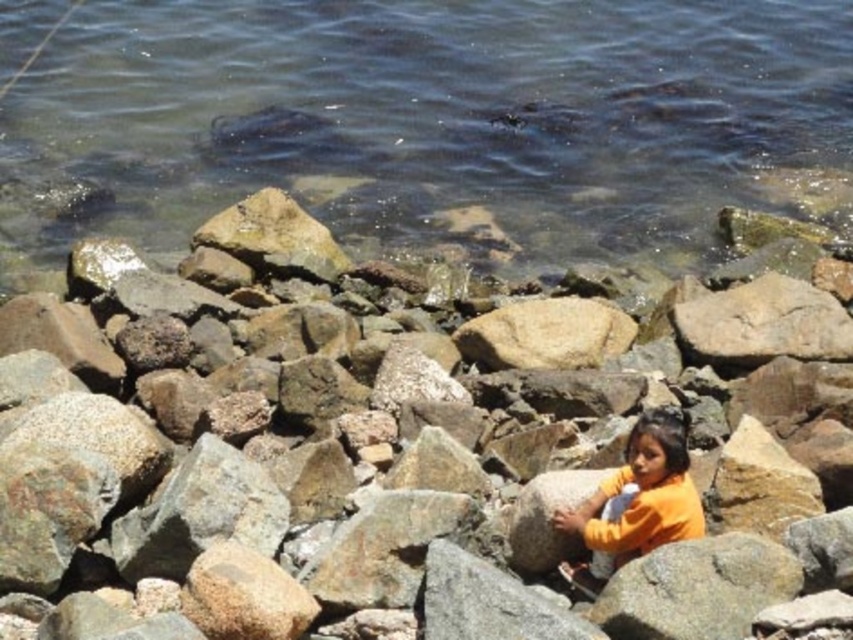
Is the position of smooth gray rock at center less distant than that of orange cotton shirt at center?

That is True.

Locate an element on the screen. The width and height of the screenshot is (853, 640). smooth gray rock at center is located at coordinates (358, 420).

Where is `smooth gray rock at center`? This screenshot has width=853, height=640. smooth gray rock at center is located at coordinates (358, 420).

Can you confirm if smooth gray rock at center is taller than clear water at upper center?

Incorrect, smooth gray rock at center's height is not larger of clear water at upper center's.

Based on the photo, is smooth gray rock at center closer to camera compared to clear water at upper center?

Yes.

Is point (47, 632) closer to viewer compared to point (558, 109)?

Yes, point (47, 632) is in front of point (558, 109).

Locate an element on the screen. smooth gray rock at center is located at coordinates (358, 420).

How far apart are clear water at upper center and orange cotton shirt at center?

clear water at upper center is 13.11 meters away from orange cotton shirt at center.

The width and height of the screenshot is (853, 640). What do you see at coordinates (421, 118) in the screenshot?
I see `clear water at upper center` at bounding box center [421, 118].

What do you see at coordinates (421, 118) in the screenshot?
I see `clear water at upper center` at bounding box center [421, 118].

You are a GUI agent. You are given a task and a screenshot of the screen. Output one action in this format:
    pyautogui.click(x=<x>, y=<y>)
    Task: Click on the clear water at upper center
    The image size is (853, 640).
    Given the screenshot: What is the action you would take?
    pyautogui.click(x=421, y=118)